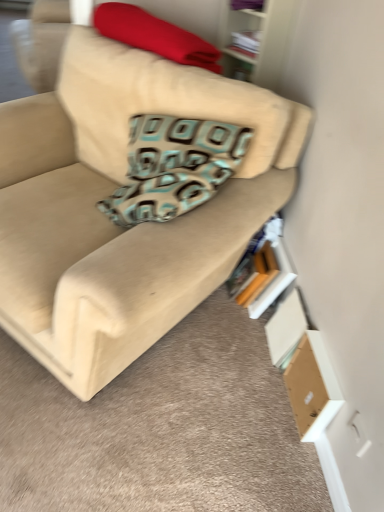
You are a GUI agent. You are given a task and a screenshot of the screen. Output one action in this format:
    pyautogui.click(x=<x>, y=<y>)
    Task: Click on the free space in front of brown cardboard box at lower right
    Image resolution: width=384 pixels, height=512 pixels.
    Given the screenshot: What is the action you would take?
    pyautogui.click(x=290, y=452)